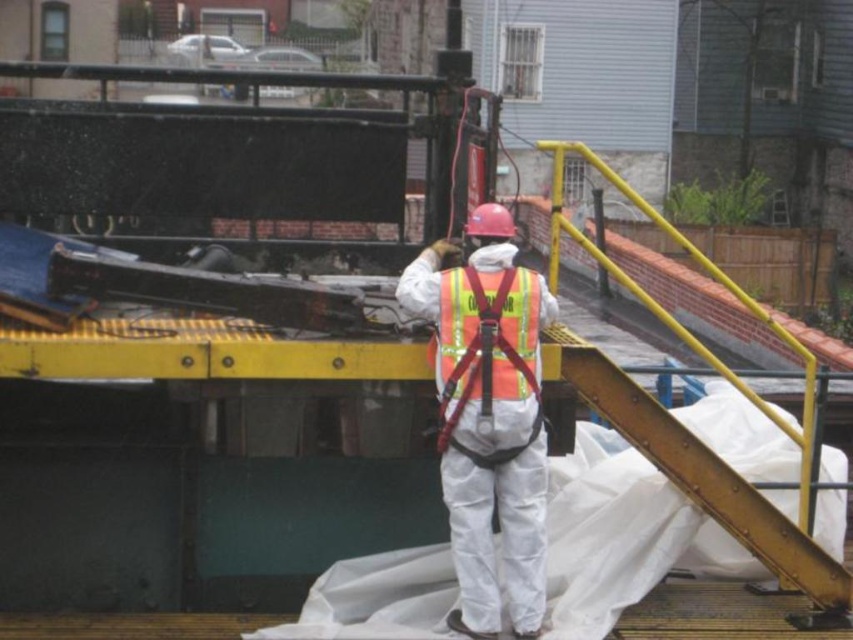
Which is more to the left, white reflective safety vest at center or reflective orange safety vest at center?

Positioned to the left is white reflective safety vest at center.

Can you confirm if white reflective safety vest at center is bigger than reflective orange safety vest at center?

Indeed, white reflective safety vest at center has a larger size compared to reflective orange safety vest at center.

Does point (463, 600) come farther from viewer compared to point (463, 376)?

Yes.

Identify the location of white reflective safety vest at center. The image size is (853, 640). pyautogui.click(x=488, y=419).